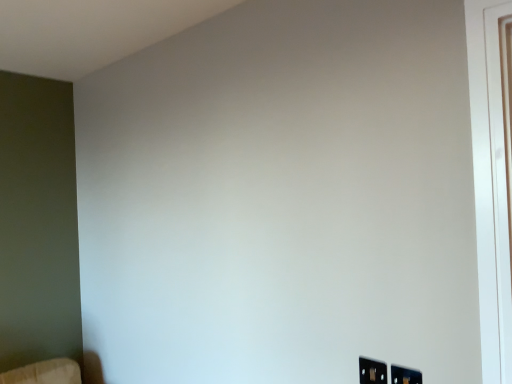
The height and width of the screenshot is (384, 512). What do you see at coordinates (372, 371) in the screenshot?
I see `black plastic electric outlet at lower right, the first electric outlet positioned from the back` at bounding box center [372, 371].

At what (x,y) coordinates should I click in order to perform the action: click on black plastic electric outlet at lower right, acting as the second electric outlet starting from the front. Please return your answer as a coordinate pair (x, y). The image size is (512, 384). Looking at the image, I should click on (372, 371).

You are a GUI agent. You are given a task and a screenshot of the screen. Output one action in this format:
    pyautogui.click(x=<x>, y=<y>)
    Task: Click on the black plastic electric outlet at lower right, arranged as the 2th electric outlet when viewed from the back
    
    Given the screenshot: What is the action you would take?
    pyautogui.click(x=405, y=375)

Image resolution: width=512 pixels, height=384 pixels. What do you see at coordinates (405, 375) in the screenshot? I see `black plastic electric outlet at lower right, the 1th electric outlet in the right-to-left sequence` at bounding box center [405, 375].

The height and width of the screenshot is (384, 512). What are the coordinates of `black plastic electric outlet at lower right, placed as the first electric outlet when sorted from left to right` in the screenshot? It's located at (372, 371).

Which is more to the right, black plastic electric outlet at lower right, placed as the first electric outlet when sorted from left to right, or black plastic electric outlet at lower right, arranged as the 2th electric outlet when viewed from the left?

Positioned to the right is black plastic electric outlet at lower right, arranged as the 2th electric outlet when viewed from the left.

Is black plastic electric outlet at lower right, placed as the first electric outlet when sorted from left to right, further to camera compared to black plastic electric outlet at lower right, the 1th electric outlet positioned from the front?

Yes, black plastic electric outlet at lower right, placed as the first electric outlet when sorted from left to right, is further from the viewer.

Which is farther from the camera, (364,363) or (416,379)?

Positioned behind is point (364,363).

From the image's perspective, is black plastic electric outlet at lower right, the first electric outlet positioned from the back, above or below black plastic electric outlet at lower right, the 1th electric outlet in the right-to-left sequence?

Clearly, from the image's perspective, black plastic electric outlet at lower right, the first electric outlet positioned from the back, is above black plastic electric outlet at lower right, the 1th electric outlet in the right-to-left sequence.

From a real-world perspective, which object rests below the other?

black plastic electric outlet at lower right, the 1th electric outlet in the right-to-left sequence, from a real-world perspective.

Is black plastic electric outlet at lower right, placed as the first electric outlet when sorted from left to right, wider than black plastic electric outlet at lower right, arranged as the 2th electric outlet when viewed from the left?

In fact, black plastic electric outlet at lower right, placed as the first electric outlet when sorted from left to right, might be narrower than black plastic electric outlet at lower right, arranged as the 2th electric outlet when viewed from the left.

Which of these two, black plastic electric outlet at lower right, positioned as the 2th electric outlet in right-to-left order, or black plastic electric outlet at lower right, the 1th electric outlet positioned from the front, stands taller?

With more height is black plastic electric outlet at lower right, the 1th electric outlet positioned from the front.

Considering the sizes of objects black plastic electric outlet at lower right, placed as the first electric outlet when sorted from left to right, and black plastic electric outlet at lower right, arranged as the 2th electric outlet when viewed from the back, in the image provided, who is bigger, black plastic electric outlet at lower right, placed as the first electric outlet when sorted from left to right, or black plastic electric outlet at lower right, arranged as the 2th electric outlet when viewed from the back,?

black plastic electric outlet at lower right, arranged as the 2th electric outlet when viewed from the back, is bigger.

Is black plastic electric outlet at lower right, the 1th electric outlet in the right-to-left sequence, completely or partially inside black plastic electric outlet at lower right, the first electric outlet positioned from the back?

No, black plastic electric outlet at lower right, the 1th electric outlet in the right-to-left sequence, is not a part of black plastic electric outlet at lower right, the first electric outlet positioned from the back.

Is black plastic electric outlet at lower right, positioned as the 2th electric outlet in right-to-left order, beside black plastic electric outlet at lower right, arranged as the 2th electric outlet when viewed from the back?

Yes, black plastic electric outlet at lower right, positioned as the 2th electric outlet in right-to-left order, and black plastic electric outlet at lower right, arranged as the 2th electric outlet when viewed from the back, clearly make contact.

Does black plastic electric outlet at lower right, placed as the first electric outlet when sorted from left to right, turn towards black plastic electric outlet at lower right, arranged as the 2th electric outlet when viewed from the back?

No, black plastic electric outlet at lower right, placed as the first electric outlet when sorted from left to right, is not aimed at black plastic electric outlet at lower right, arranged as the 2th electric outlet when viewed from the back.

How different are the orientations of black plastic electric outlet at lower right, the first electric outlet positioned from the back, and black plastic electric outlet at lower right, the 1th electric outlet positioned from the front, in degrees?

black plastic electric outlet at lower right, the first electric outlet positioned from the back, and black plastic electric outlet at lower right, the 1th electric outlet positioned from the front, are facing 0.255 degrees away from each other.

The image size is (512, 384). In order to click on electric outlet below the black plastic electric outlet at lower right, the first electric outlet positioned from the back (from the image's perspective) in this screenshot , I will do `click(405, 375)`.

Is black plastic electric outlet at lower right, the 1th electric outlet in the right-to-left sequence, to the left or to the right of black plastic electric outlet at lower right, positioned as the 2th electric outlet in right-to-left order, in the image?

black plastic electric outlet at lower right, the 1th electric outlet in the right-to-left sequence, is to the right of black plastic electric outlet at lower right, positioned as the 2th electric outlet in right-to-left order.

Does black plastic electric outlet at lower right, arranged as the 2th electric outlet when viewed from the left, come in front of black plastic electric outlet at lower right, the first electric outlet positioned from the back?

Yes.

Does point (411, 382) come behind point (365, 364)?

That is False.

From the image's perspective, does black plastic electric outlet at lower right, the 1th electric outlet positioned from the front, appear lower than black plastic electric outlet at lower right, acting as the second electric outlet starting from the front?

Yes, from the image's perspective, black plastic electric outlet at lower right, the 1th electric outlet positioned from the front, is below black plastic electric outlet at lower right, acting as the second electric outlet starting from the front.

From the picture: From a real-world perspective, is black plastic electric outlet at lower right, the 1th electric outlet in the right-to-left sequence, positioned under black plastic electric outlet at lower right, positioned as the 2th electric outlet in right-to-left order, based on gravity?

Yes.

Considering the sizes of objects black plastic electric outlet at lower right, the 1th electric outlet in the right-to-left sequence, and black plastic electric outlet at lower right, the first electric outlet positioned from the back, in the image provided, who is thinner, black plastic electric outlet at lower right, the 1th electric outlet in the right-to-left sequence, or black plastic electric outlet at lower right, the first electric outlet positioned from the back,?

black plastic electric outlet at lower right, the first electric outlet positioned from the back, is thinner.

Is black plastic electric outlet at lower right, the 1th electric outlet positioned from the front, shorter than black plastic electric outlet at lower right, the first electric outlet positioned from the back?

No.

Which of these two, black plastic electric outlet at lower right, the 1th electric outlet in the right-to-left sequence, or black plastic electric outlet at lower right, placed as the first electric outlet when sorted from left to right, is smaller?

black plastic electric outlet at lower right, placed as the first electric outlet when sorted from left to right.

Is black plastic electric outlet at lower right, arranged as the 2th electric outlet when viewed from the left, located outside black plastic electric outlet at lower right, positioned as the 2th electric outlet in right-to-left order?

black plastic electric outlet at lower right, arranged as the 2th electric outlet when viewed from the left, is positioned outside black plastic electric outlet at lower right, positioned as the 2th electric outlet in right-to-left order.

Are black plastic electric outlet at lower right, the 1th electric outlet in the right-to-left sequence, and black plastic electric outlet at lower right, the first electric outlet positioned from the back, beside each other?

Absolutely, black plastic electric outlet at lower right, the 1th electric outlet in the right-to-left sequence, is next to and touching black plastic electric outlet at lower right, the first electric outlet positioned from the back.

Could you tell me if black plastic electric outlet at lower right, the 1th electric outlet in the right-to-left sequence, is facing black plastic electric outlet at lower right, acting as the second electric outlet starting from the front?

No.

This screenshot has width=512, height=384. There is a black plastic electric outlet at lower right, the 1th electric outlet in the right-to-left sequence. What are the coordinates of `electric outlet above it (from a real-world perspective)` in the screenshot? It's located at (372, 371).

Locate an element on the screen. electric outlet behind the black plastic electric outlet at lower right, arranged as the 2th electric outlet when viewed from the back is located at coordinates (372, 371).

Image resolution: width=512 pixels, height=384 pixels. In order to click on electric outlet located above the black plastic electric outlet at lower right, arranged as the 2th electric outlet when viewed from the back (from a real-world perspective) in this screenshot , I will do `click(372, 371)`.